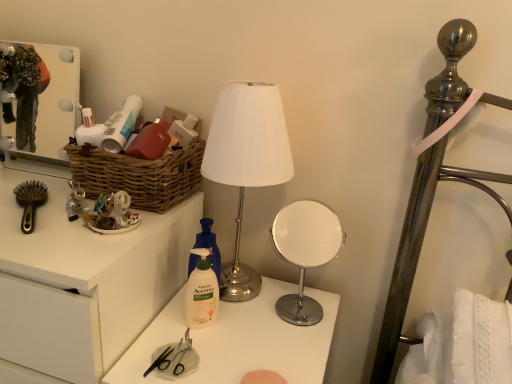
Identify the location of free space to the left of white glossy mirror at center right. The image size is (512, 384). (245, 311).